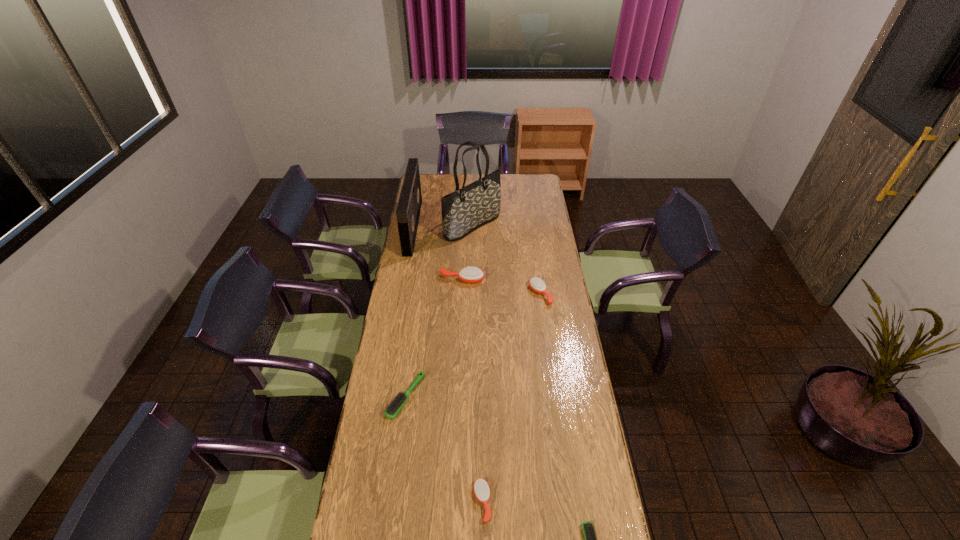
You are a GUI agent. You are given a task and a screenshot of the screen. Output one action in this format:
    pyautogui.click(x=<x>, y=<y>)
    Task: Click on the vacant space at the left edge of the desktop
    Image resolution: width=960 pixels, height=540 pixels.
    Given the screenshot: What is the action you would take?
    pyautogui.click(x=418, y=263)

What are the coordinates of `free space at the right edge of the desktop` in the screenshot? It's located at (526, 194).

The height and width of the screenshot is (540, 960). What are the coordinates of `free space between the black videotape and the second tallest hairbrush` in the screenshot? It's located at (476, 261).

This screenshot has height=540, width=960. I want to click on vacant area that lies between the tote bag and the nearest orange hairbrush, so click(477, 364).

This screenshot has height=540, width=960. Identify the location of blank region between the videotape and the rightmost orange hairbrush. (476, 261).

I want to click on object that is the fourth closest to the tallest object, so click(398, 401).

This screenshot has height=540, width=960. Find the location of `object that is the third closest to the shortest hairbrush`. object that is the third closest to the shortest hairbrush is located at coordinates (536, 284).

Find the location of a particular element. the second closest hairbrush to the second tallest hairbrush is located at coordinates (398, 401).

Choose which hairbrush is the nearest neighbor to the second tallest hairbrush. Please provide its 2D coordinates. Your answer should be formatted as a tuple, i.e. [(x, y)], where the tuple contains the x and y coordinates of a point satisfying the conditions above.

[(471, 274)]

Identify which orange hairbrush is the second closest to the shortest object. Please provide its 2D coordinates. Your answer should be formatted as a tuple, i.e. [(x, y)], where the tuple contains the x and y coordinates of a point satisfying the conditions above.

[(536, 284)]